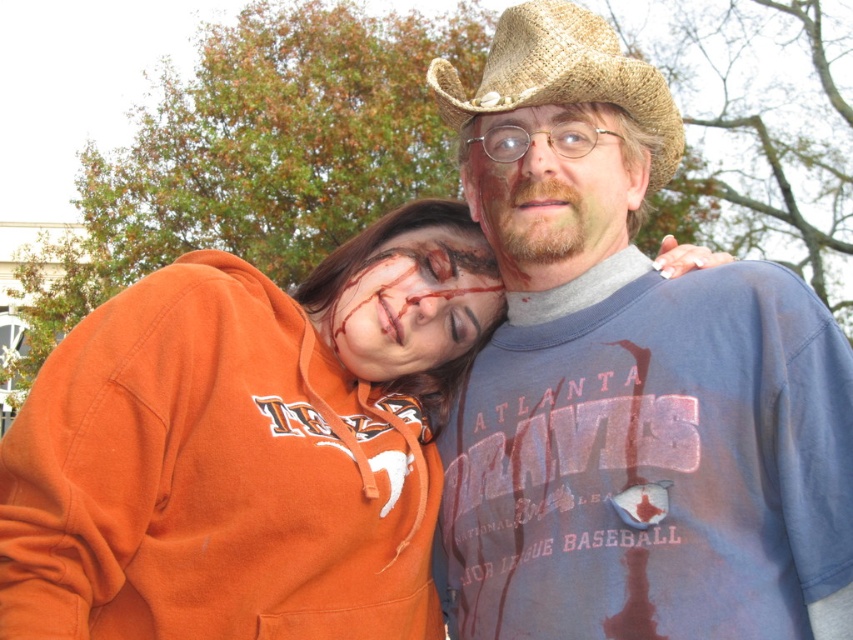
Who is positioned more to the right, orange fleece hoodie at center or brown straw cowboy hat at upper center?

From the viewer's perspective, brown straw cowboy hat at upper center appears more on the right side.

Is orange fleece hoodie at center to the left of brown straw cowboy hat at upper center from the viewer's perspective?

Indeed, orange fleece hoodie at center is positioned on the left side of brown straw cowboy hat at upper center.

Between point (86, 516) and point (485, 72), which one is positioned behind?

The point (485, 72) is more distant.

Find the location of a particular element. The width and height of the screenshot is (853, 640). orange fleece hoodie at center is located at coordinates (247, 445).

Is orange fleece hoodie at center wider than matte brown cowboy hat at center?

No, orange fleece hoodie at center is not wider than matte brown cowboy hat at center.

Is orange fleece hoodie at center bigger than matte brown cowboy hat at center?

Actually, orange fleece hoodie at center might be smaller than matte brown cowboy hat at center.

Image resolution: width=853 pixels, height=640 pixels. Find the location of `orange fleece hoodie at center`. orange fleece hoodie at center is located at coordinates (247, 445).

Does blue cotton t-shirt at center have a lesser height compared to matte orange hoodie at center?

Correct, blue cotton t-shirt at center is not as tall as matte orange hoodie at center.

Where is `blue cotton t-shirt at center`? The image size is (853, 640). blue cotton t-shirt at center is located at coordinates (630, 381).